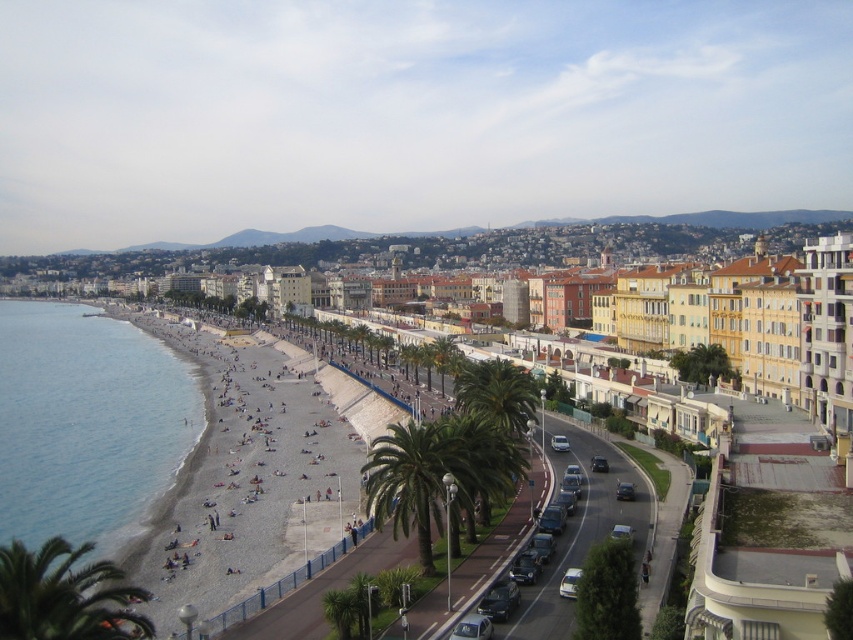
Question: Which point is closer to the camera?

Choices:
 (A) (456, 632)
 (B) (602, 458)

Answer: (A)

Question: Does satin black sedan at center-right appear over silver metallic sedan at center-right?

Choices:
 (A) yes
 (B) no

Answer: (B)

Question: Is blue water at beach left to the left of white glossy car at center-right from the viewer's perspective?

Choices:
 (A) no
 (B) yes

Answer: (B)

Question: Considering the relative positions of blue water at beach left and metallic silver car at center in the image provided, where is blue water at beach left located with respect to metallic silver car at center?

Choices:
 (A) above
 (B) below

Answer: (A)

Question: Which point appears farthest from the camera in this image?

Choices:
 (A) (575, 586)
 (B) (631, 493)
 (C) (146, 388)

Answer: (C)

Question: Which object appears closest to the camera in this image?

Choices:
 (A) white glossy car at center-right
 (B) green leafy palm tree at center
 (C) blue water at beach left

Answer: (A)